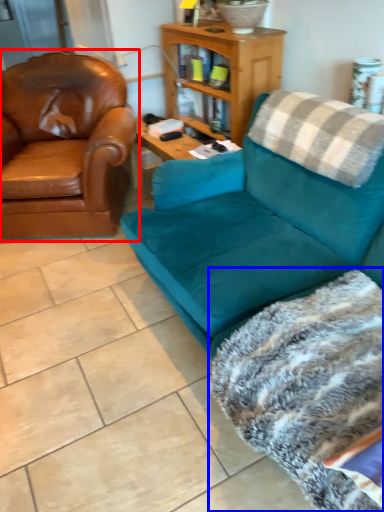
Question: Which of the following is the farthest to the observer, chair (highlighted by a red box) or blanket (highlighted by a blue box)?

Choices:
 (A) chair
 (B) blanket

Answer: (A)